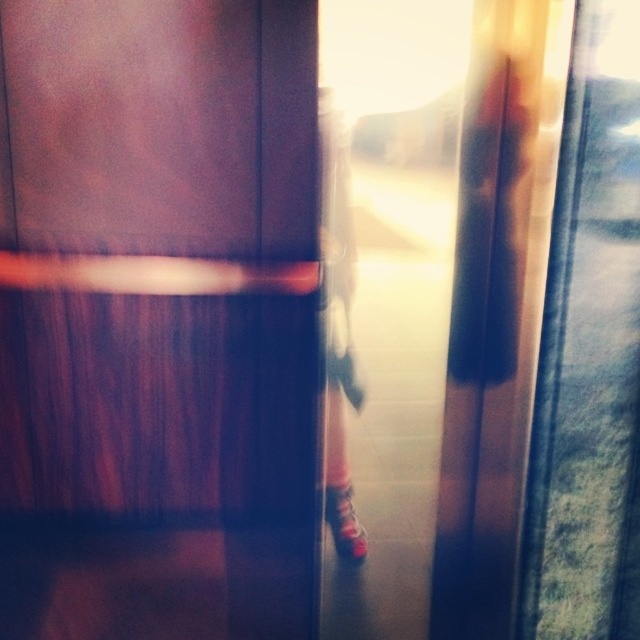
You are inside an elevator and want to know if the wooden elevator door at center will open wide enough to let the pink fabric dress at center pass through. Can you confirm this?

The wooden elevator door at center is larger in size than pink fabric dress at center, so it should open wide enough for the pink fabric dress at center to pass through.

You are a passenger in the vehicle and want to know where to place your bag. The wooden elevator door at center and the pink fabric dress at center are in your view. Which object is lower in the image?

The wooden elevator door at center is below the pink fabric dress at center, so the wooden elevator door at center is lower in the image.

You are a passenger on a moving vehicle and you see a pink fabric dress at center and a shiny red shoe at center through the window. Which object is closer to the window?

The pink fabric dress at center is above the shiny red shoe at center, so the pink fabric dress at center is closer to the window.